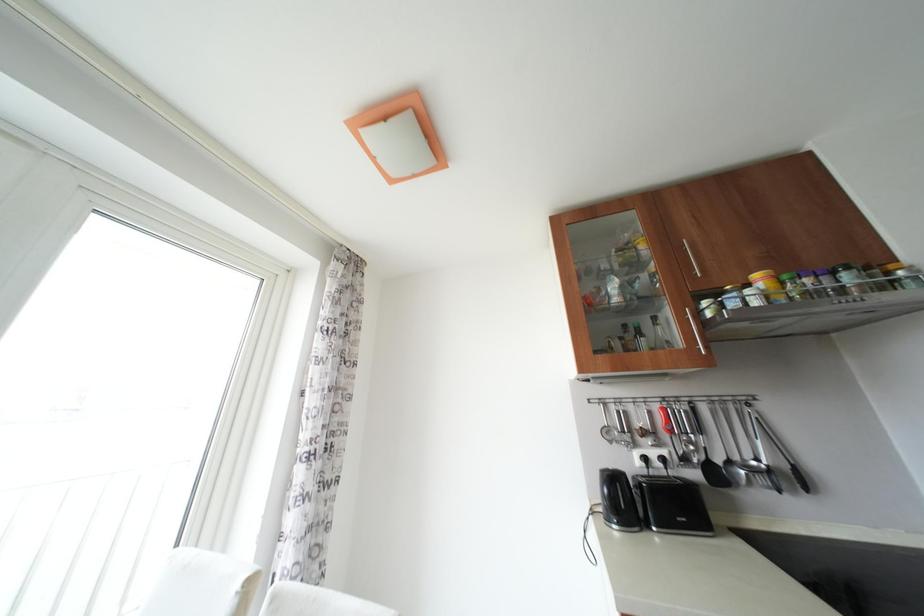
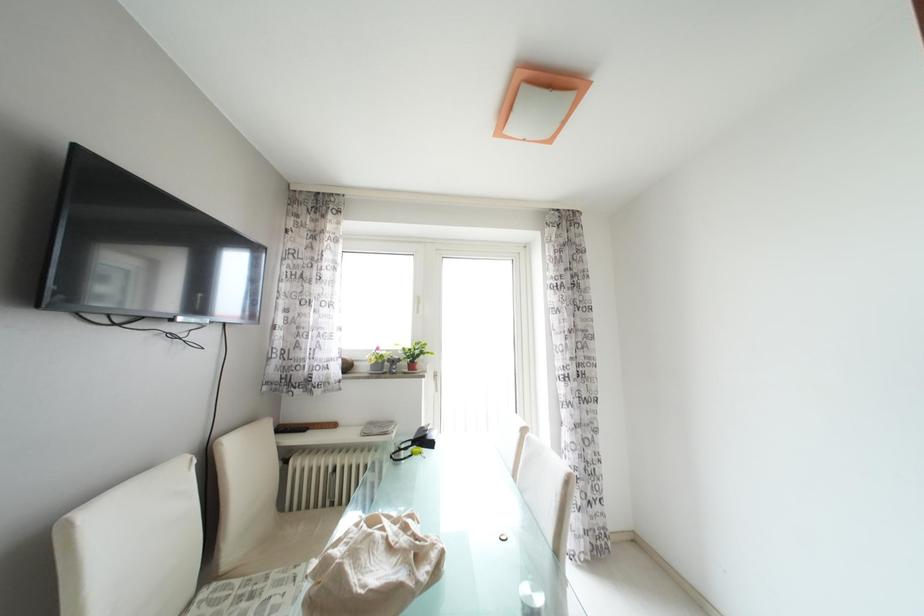
Question: How did the camera likely rotate?

Choices:
 (A) Left
 (B) Right
 (C) Up
 (D) Down

Answer: (A)